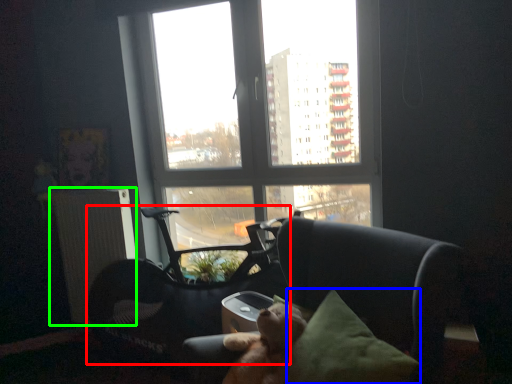
Question: Which object is positioned farthest from swivel chair (highlighted by a red box)? Select from pillow (highlighted by a blue box) and radiator (highlighted by a green box).

Choices:
 (A) pillow
 (B) radiator

Answer: (A)